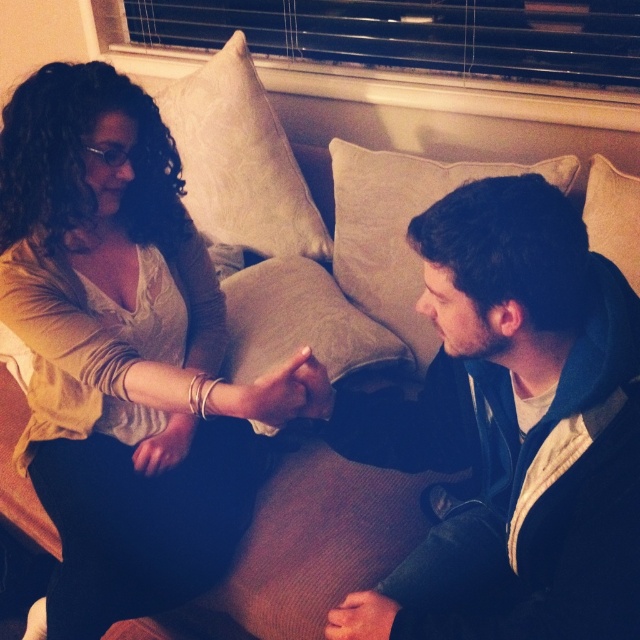
Can you confirm if matte beige sweater at upper left is smaller than dark blue hoodie at center?

Incorrect, matte beige sweater at upper left is not smaller in size than dark blue hoodie at center.

Is matte beige sweater at upper left to the right of dark blue hoodie at center from the viewer's perspective?

Incorrect, matte beige sweater at upper left is not on the right side of dark blue hoodie at center.

Where is `matte beige sweater at upper left`? The image size is (640, 640). matte beige sweater at upper left is located at coordinates (122, 353).

Does point (275, 120) come farther from viewer compared to point (634, 282)?

Yes, it is.

Is linen pillow at upper center thinner than beige fabric pillow at upper right?

No, linen pillow at upper center is not thinner than beige fabric pillow at upper right.

Find the location of a particular element. This screenshot has width=640, height=640. linen pillow at upper center is located at coordinates (240, 161).

Is matte beige sweater at upper left shorter than beige fabric pillow at center?

In fact, matte beige sweater at upper left may be taller than beige fabric pillow at center.

Which is behind, point (54, 621) or point (410, 273)?

Point (410, 273)

Image resolution: width=640 pixels, height=640 pixels. What do you see at coordinates (122, 353) in the screenshot?
I see `matte beige sweater at upper left` at bounding box center [122, 353].

Where is `matte beige sweater at upper left`? matte beige sweater at upper left is located at coordinates (122, 353).